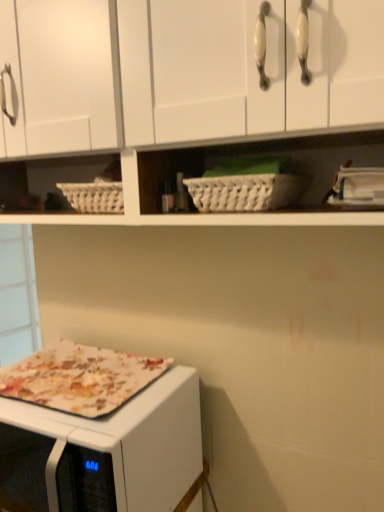
Question: Is floral fabric microwave oven at lower left completely or partially inside white matte cabinet at upper center?

Choices:
 (A) yes
 (B) no

Answer: (B)

Question: Is white matte cabinet at upper center to the left of floral fabric microwave oven at lower left from the viewer's perspective?

Choices:
 (A) yes
 (B) no

Answer: (B)

Question: Is white matte cabinet at upper center at the right side of floral fabric microwave oven at lower left?

Choices:
 (A) yes
 (B) no

Answer: (A)

Question: From the image's perspective, does white matte cabinet at upper center appear higher than floral fabric microwave oven at lower left?

Choices:
 (A) no
 (B) yes

Answer: (B)

Question: From a real-world perspective, does white matte cabinet at upper center sit lower than floral fabric microwave oven at lower left?

Choices:
 (A) yes
 (B) no

Answer: (B)

Question: Visually, is floral fabric microwave oven at lower left positioned to the left or to the right of printed fabric pizza at lower left?

Choices:
 (A) left
 (B) right

Answer: (A)

Question: Is point (6, 412) closer or farther from the camera than point (39, 377)?

Choices:
 (A) closer
 (B) farther

Answer: (A)

Question: In terms of size, does floral fabric microwave oven at lower left appear bigger or smaller than printed fabric pizza at lower left?

Choices:
 (A) small
 (B) big

Answer: (B)

Question: Is floral fabric microwave oven at lower left taller or shorter than printed fabric pizza at lower left?

Choices:
 (A) tall
 (B) short

Answer: (A)

Question: Is point (244, 181) positioned closer to the camera than point (51, 382)?

Choices:
 (A) closer
 (B) farther

Answer: (A)

Question: Considering the positions of white wicker basket at center and printed fabric pizza at lower left in the image, is white wicker basket at center wider or thinner than printed fabric pizza at lower left?

Choices:
 (A) thin
 (B) wide

Answer: (A)

Question: From the image's perspective, is white wicker basket at center positioned above or below printed fabric pizza at lower left?

Choices:
 (A) above
 (B) below

Answer: (A)

Question: From a real-world perspective, relative to printed fabric pizza at lower left, is white wicker basket at center vertically above or below?

Choices:
 (A) above
 (B) below

Answer: (A)

Question: In terms of size, does white matte cabinet at upper center appear bigger or smaller than printed fabric pizza at lower left?

Choices:
 (A) big
 (B) small

Answer: (A)

Question: Is white matte cabinet at upper center in front of or behind printed fabric pizza at lower left in the image?

Choices:
 (A) front
 (B) behind

Answer: (A)